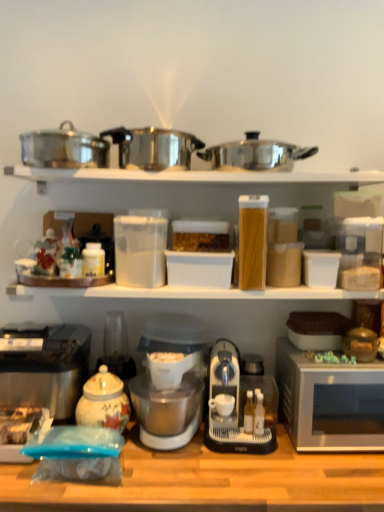
Question: Is point (372, 245) positioned closer to the camera than point (180, 323)?

Choices:
 (A) closer
 (B) farther

Answer: (A)

Question: Relative to white plastic coffee maker at center, is clear plastic container at upper center, the 2th appliance from the bottom, in front or behind?

Choices:
 (A) behind
 (B) front

Answer: (A)

Question: Which object is positioned closest to the metallic pots at upper center?

Choices:
 (A) translucent plastic container at center
 (B) shiny metallic crock pot at center, which appears as the 2th crock pot when viewed from the right
 (C) wooden table at lower center
 (D) porcelain floral jar at center, acting as the 1th appliance starting from the bottom
 (E) metallic silver toaster at lower left

Answer: (B)

Question: Estimate the real-world distances between objects in this image. Which object is closer to the translucent plastic container at center?

Choices:
 (A) stainless steel crock pot at upper left, the third crock pot from the right
 (B) porcelain floral tea pot at lower left
 (C) wooden table at lower center
 (D) metallic pots at upper center
 (E) white plastic coffee maker at center

Answer: (D)